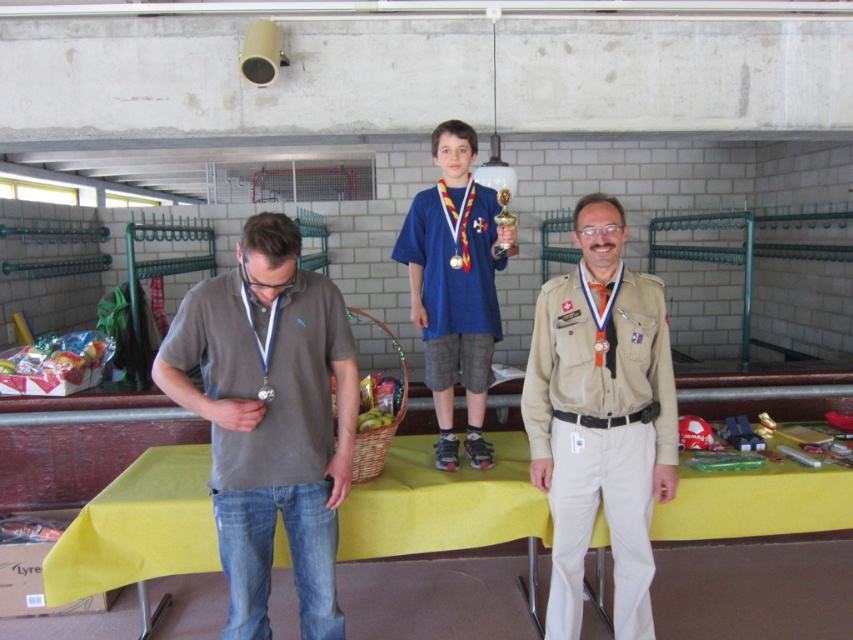
You are standing in the gymnasium and see two points marked on the wall. The first point is at coordinates point [405,225] and the second point is at point [460,260]. Which point is closer to you?

Point [405,225] is closer to you because it is further to the viewer than point [460,260].

You are a photographer positioned behind the table and want to capture both the tan uniform at center and the metallic silver medal at center in your shot. Which object will appear larger in your photo?

The tan uniform at center will appear larger in the photo because it is closer to the viewer than the metallic silver medal at center.

You are a photographer standing at the back of the gymnasium. You want to take a photo of the two people wearing the matte gray shirt at center and blue fabric shirt at center so that both are clearly visible in the frame. Given that your camera has a minimum focus distance of 30 inches, will you need to step forward or backward to ensure both are in focus?

The matte gray shirt at center and blue fabric shirt at center are 29.18 inches apart from each other. Since the distance between them is less than the camera minimum focus distance of 30 inches, you need to step forward to ensure both are in focus.